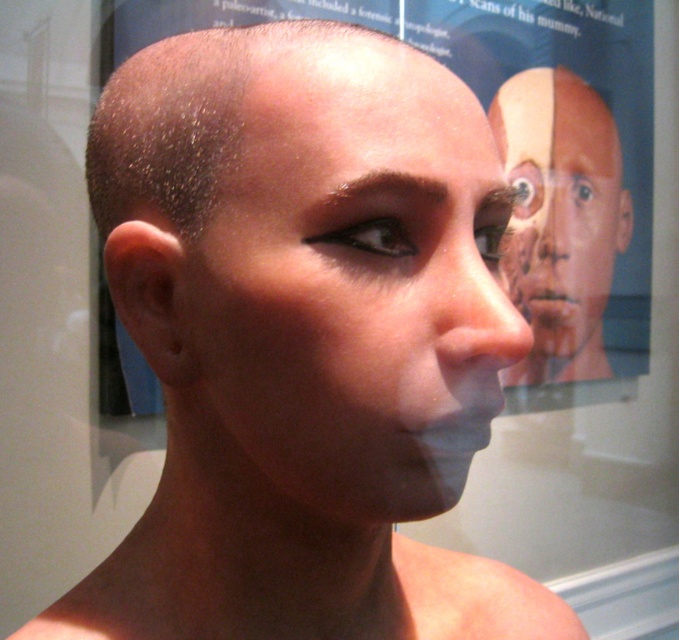
You are an artist preparing to sketch this scene. You need to ensure the proportions between the smooth skin head at center and the matte skin face at center are accurate. Which part should you draw first if you want to follow the correct size relationship?

The smooth skin head at center is shorter than the matte skin face at center, so you should draw the matte skin face at center first as it is taller, then adjust the smooth skin head at center to be proportionally shorter.

You are an anthropologist examining the image. You notice a specific point labeled as point (310, 259). Based on the scene description, where would this point most likely be located on the individual?

The point (310, 259) is on the smooth skin head at center.

You are an artist preparing to sketch this scene. You need to ensure your drawing accurately represents the spatial relationship between the smooth skin head at center and the matte skin face at center. Given that your sketchpad is 30 cm wide, can you fit both objects horizontally without overlapping?

The distance between the smooth skin head at center and the matte skin face at center is 1.84 meters. Since 1.84 meters is equivalent to 184 cm, which is significantly wider than the 30 cm sketchpad, the two objects cannot fit horizontally without overlapping on the sketchpad.